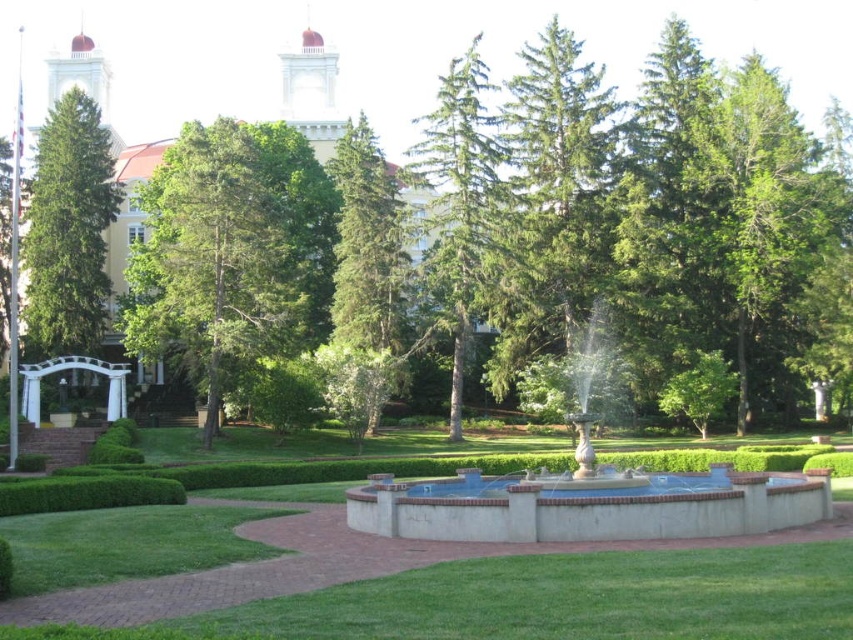
You are standing at point (457, 205) in the park. What can you see directly in front of you?

You can see a green needle like tree at center directly in front of you at point (457, 205).

You are planning to place a new bench in the park. The bench requires a space wider than the blue concrete fountain at center. Can the green matte tree at center provide enough space for the bench?

The green matte tree at center has a larger width than the blue concrete fountain at center, so the space around the green matte tree at center is wider than required for the bench. Therefore, the bench can be placed there.

You are planning to place a new bench in the park. The bench requires a space that is smaller than the green matte tree at center. Would the area near the blue concrete fountain at center be suitable?

The green matte tree at center is larger than the blue concrete fountain at center. Since the bench requires a space smaller than the tree, the area near the blue concrete fountain at center is suitable because it is smaller in size.